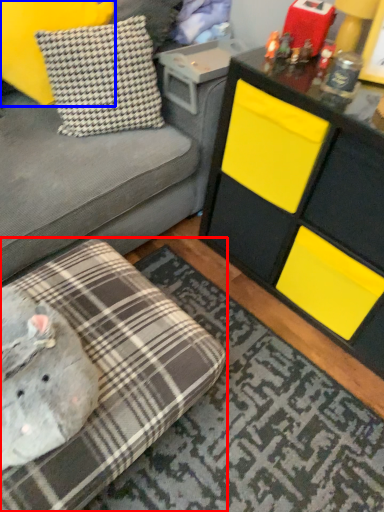
Question: Which object appears closest to the camera in this image, studio couch (highlighted by a red box) or pillow (highlighted by a blue box)?

Choices:
 (A) studio couch
 (B) pillow

Answer: (A)